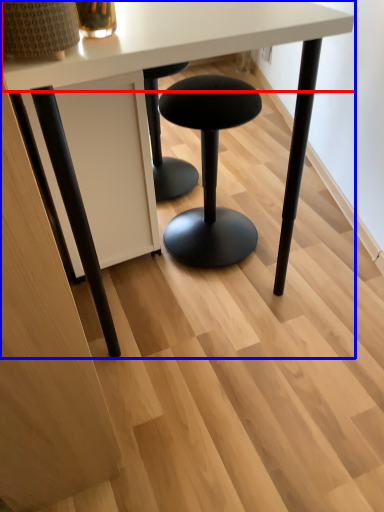
Question: Among these objects, which one is farthest to the camera, round table (highlighted by a red box) or table (highlighted by a blue box)?

Choices:
 (A) round table
 (B) table

Answer: (B)